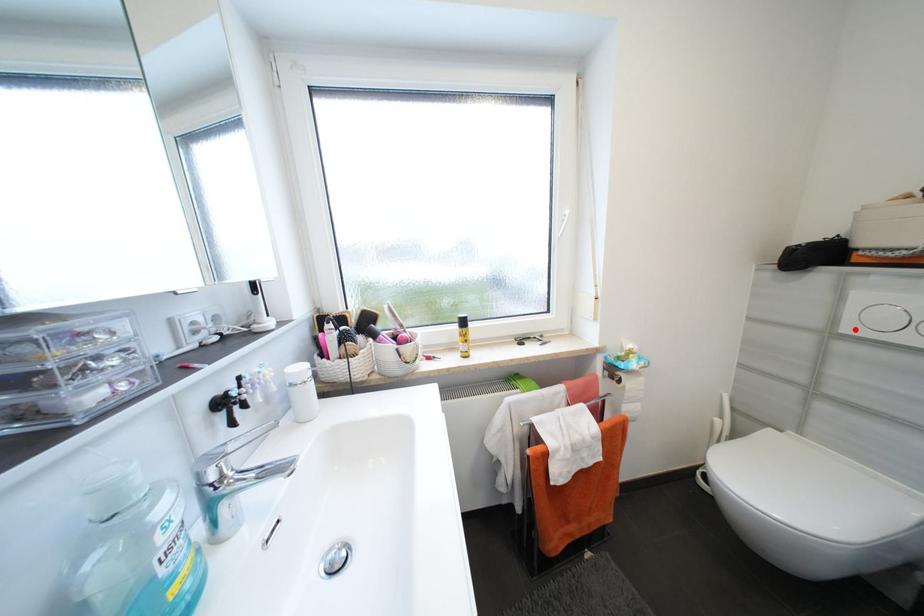
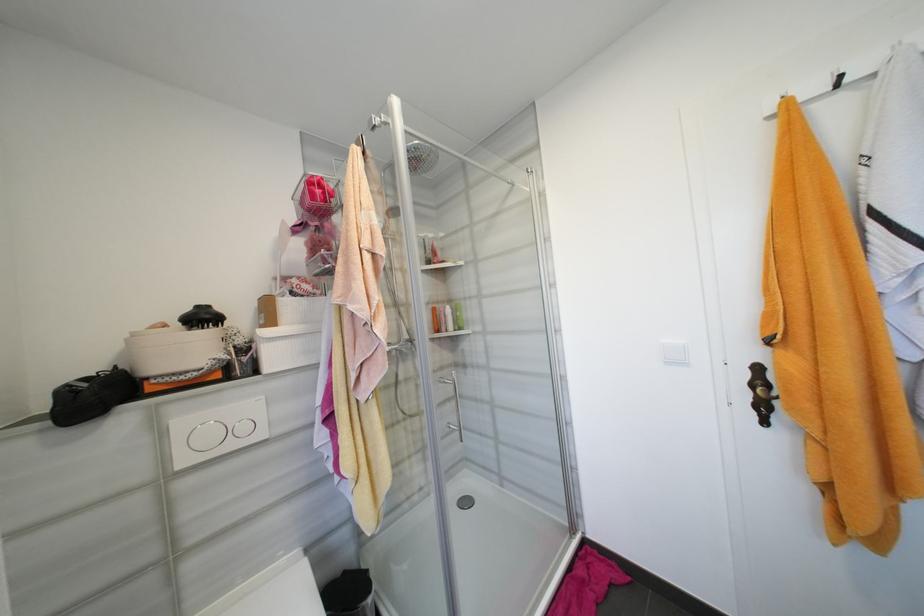
The point at the highlighted location is marked in the first image. Where is the corresponding point in the second image?

(189, 463)